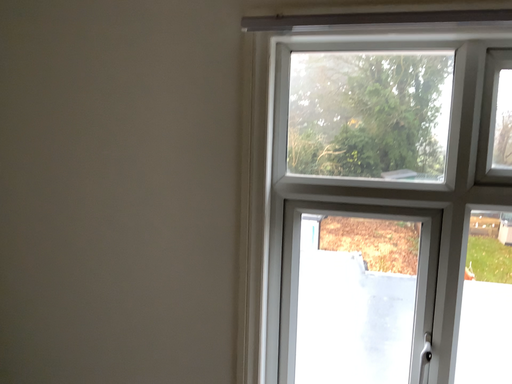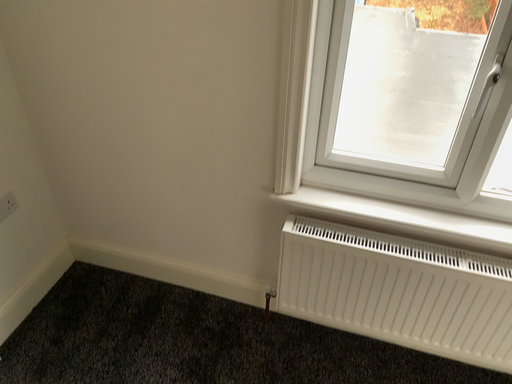
Question: How did the camera likely rotate when shooting the video?

Choices:
 (A) rotated downward
 (B) rotated upward

Answer: (A)